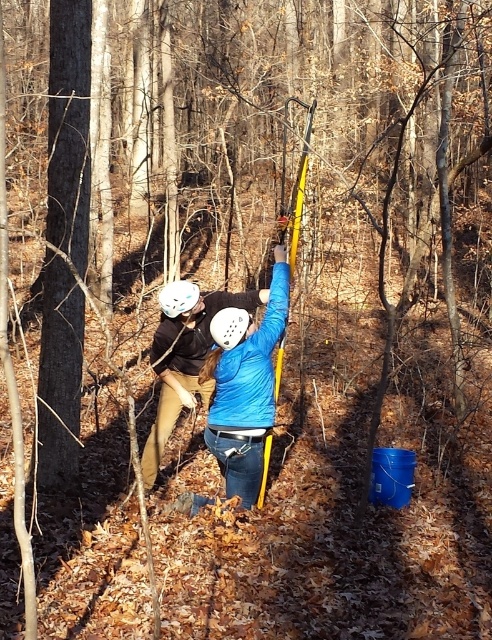
From the picture: Between blue matte jacket at center and white matte helmet at upper center, which one is positioned higher?

white matte helmet at upper center

This screenshot has height=640, width=492. What do you see at coordinates (211, 369) in the screenshot? I see `blue matte jacket at center` at bounding box center [211, 369].

Between point (158, 349) and point (182, 282), which one is positioned behind?

The point (158, 349) is behind.

Where is `blue matte jacket at center`? blue matte jacket at center is located at coordinates (211, 369).

Does point (237, 316) lie in front of point (183, 298)?

Yes.

Between white matte helmet at center and white matte helmet at upper center, which one appears on the right side from the viewer's perspective?

white matte helmet at center

Describe the element at coordinates (228, 326) in the screenshot. I see `white matte helmet at center` at that location.

You are a GUI agent. You are given a task and a screenshot of the screen. Output one action in this format:
    pyautogui.click(x=<x>, y=<y>)
    Task: Click on the white matte helmet at center
    The width and height of the screenshot is (492, 640).
    Given the screenshot: What is the action you would take?
    pyautogui.click(x=228, y=326)

Is point (155, 332) in front of point (222, 340)?

No, it is not.

Is blue matte jacket at center shorter than white matte helmet at center?

No.

Describe the element at coordinates (211, 369) in the screenshot. I see `blue matte jacket at center` at that location.

The width and height of the screenshot is (492, 640). Find the location of `blue matte jacket at center`. blue matte jacket at center is located at coordinates (211, 369).